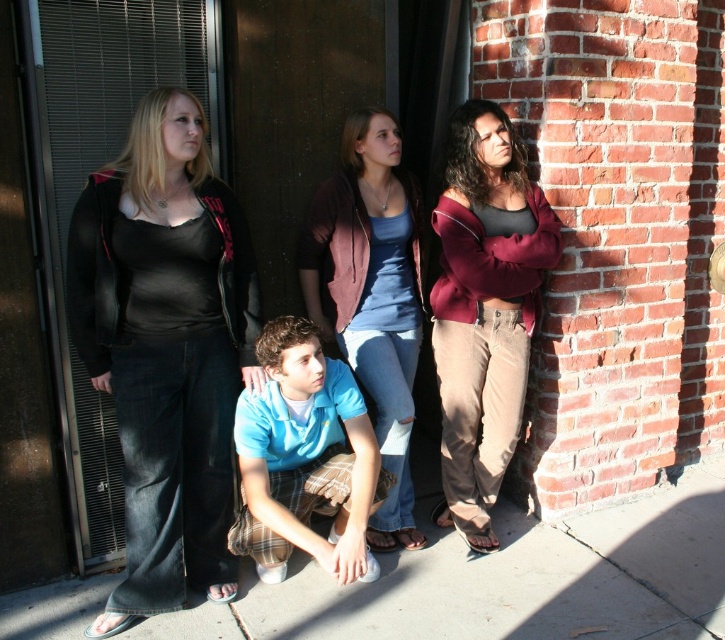
Question: Does smooth concrete pavement at lower center have a larger size compared to blue denim jeans at center?

Choices:
 (A) no
 (B) yes

Answer: (B)

Question: Considering the real-world distances, which object is closest to the smooth concrete pavement at lower center?

Choices:
 (A) matte black top at center
 (B) maroon fleece jacket at right
 (C) blue denim jeans at center

Answer: (B)

Question: Among these points, which one is farthest from the camera?

Choices:
 (A) (360, 129)
 (B) (377, 444)
 (C) (600, 566)

Answer: (A)

Question: Can you confirm if maroon fleece jacket at right is thinner than blue cotton shirt at center?

Choices:
 (A) yes
 (B) no

Answer: (A)

Question: Does matte black top at center have a lesser width compared to maroon fleece jacket at right?

Choices:
 (A) yes
 (B) no

Answer: (B)

Question: Which of these objects is positioned closest to the blue cotton shirt at center?

Choices:
 (A) blue denim jeans at center
 (B) matte black top at center
 (C) maroon fleece jacket at right

Answer: (B)